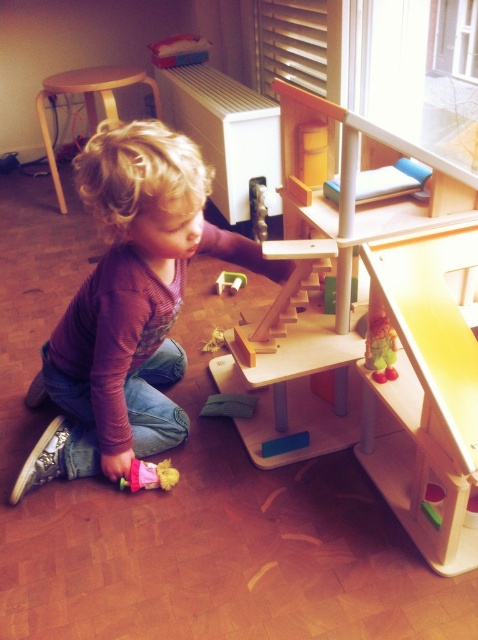
Question: Among these points, which one is farthest from the camera?

Choices:
 (A) (55, 177)
 (B) (162, 481)
 (C) (229, 276)

Answer: (A)

Question: From the image, what is the correct spatial relationship of purple soft shirt at lower left in relation to matte pink doll at lower left?

Choices:
 (A) left
 (B) right

Answer: (B)

Question: Considering the real-world distances, which object is closest to the light brown wooden stool at upper left?

Choices:
 (A) purple soft shirt at lower left
 (B) matte pink doll at lower left
 (C) wooden doll at lower right
 (D) wooden block at center

Answer: (D)

Question: Can you confirm if purple soft shirt at lower left is bigger than wooden block at center?

Choices:
 (A) yes
 (B) no

Answer: (A)

Question: Which object is positioned farthest from the wooden doll at lower right?

Choices:
 (A) light brown wooden stool at upper left
 (B) wooden block at center

Answer: (A)

Question: In this image, where is purple soft shirt at lower left located relative to wooden block at center?

Choices:
 (A) above
 (B) below

Answer: (B)